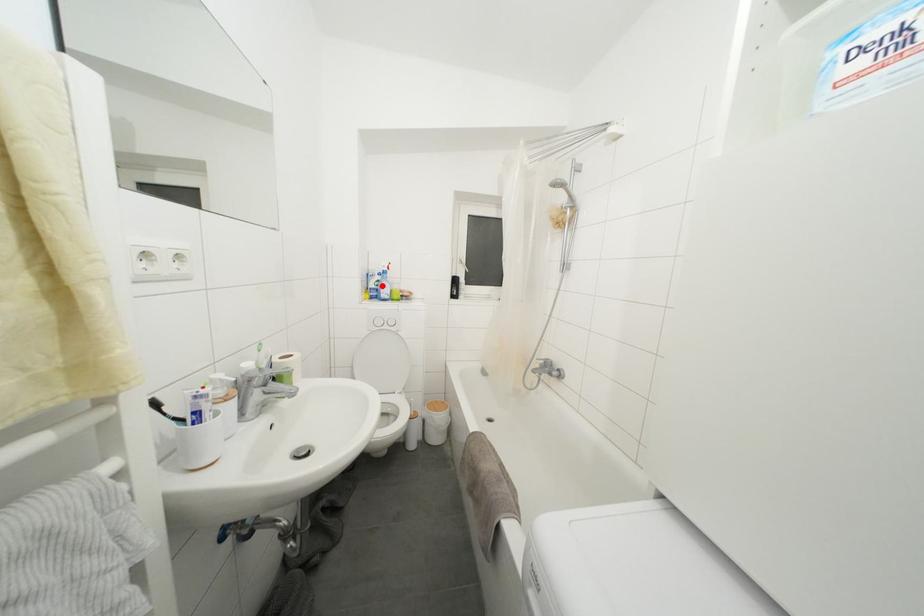
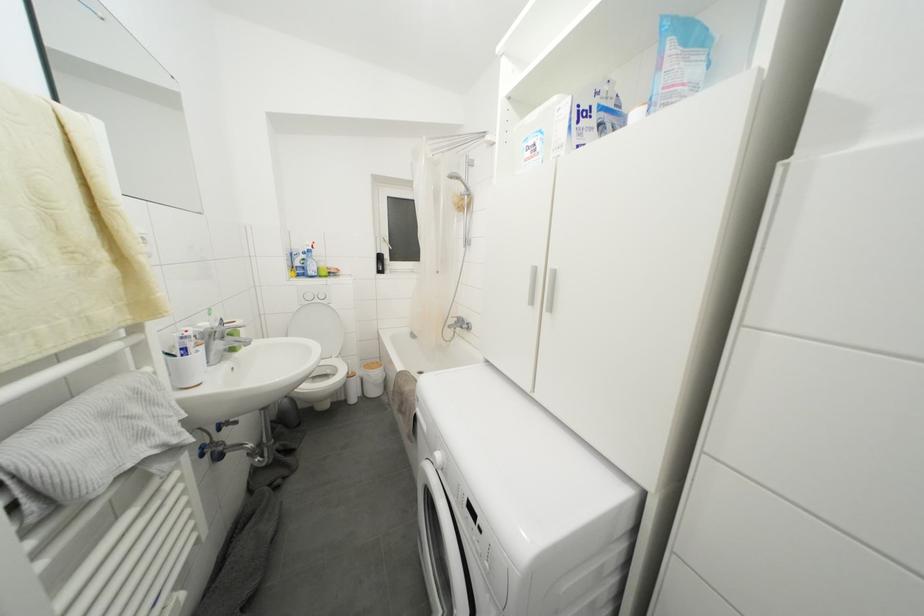
Locate, in the second image, the point that corresponds to the highlighted location in the first image.

(308, 264)